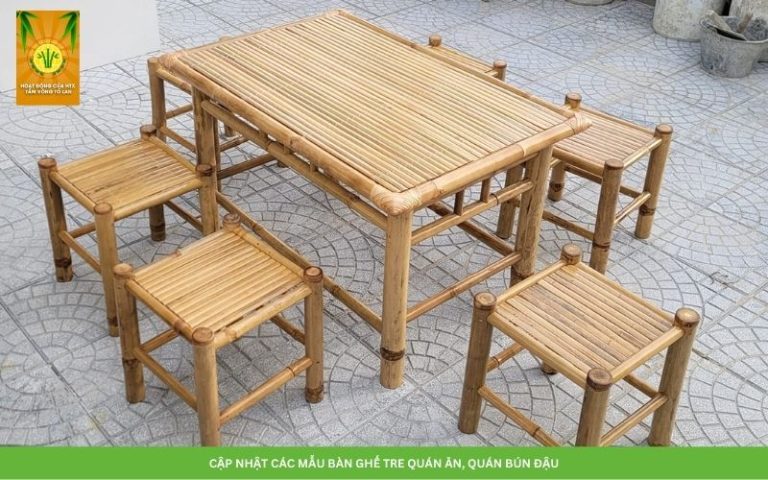
Image resolution: width=768 pixels, height=480 pixels. I want to click on light brown table, so 396,138.